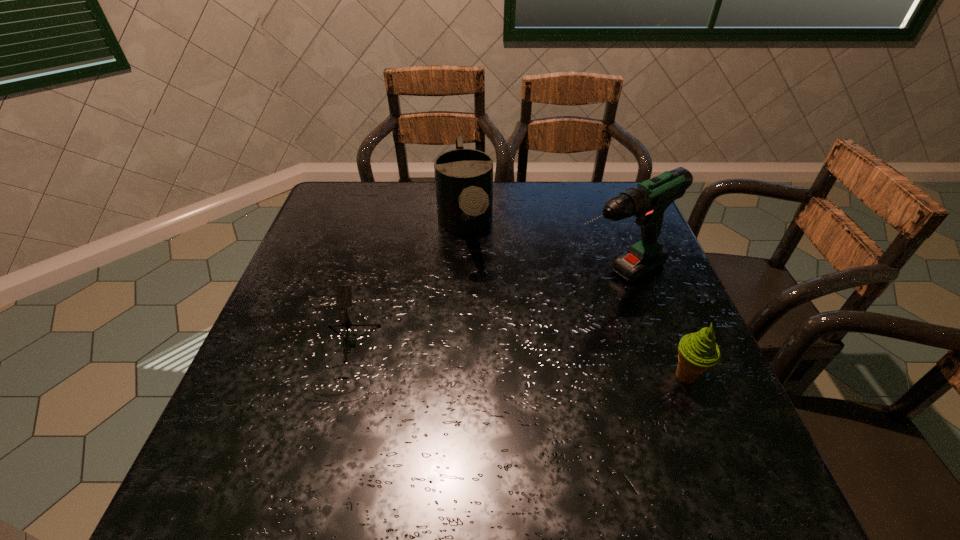
Find the location of a particular element. This screenshot has height=540, width=960. microphone is located at coordinates (344, 292).

You are a GUI agent. You are given a task and a screenshot of the screen. Output one action in this format:
    pyautogui.click(x=<x>, y=<y>)
    Task: Click on the shortest object
    
    Given the screenshot: What is the action you would take?
    pyautogui.click(x=344, y=292)

Find the location of a particular element. The image size is (960, 540). icecream is located at coordinates (697, 351).

What are the coordinates of `watering can` in the screenshot? It's located at (463, 177).

You are a GUI agent. You are given a task and a screenshot of the screen. Output one action in this format:
    pyautogui.click(x=<x>, y=<y>)
    Task: Click on the third object from right to left
    
    Given the screenshot: What is the action you would take?
    pyautogui.click(x=463, y=177)

Locate an element on the screen. The width and height of the screenshot is (960, 540). drill is located at coordinates (647, 201).

Find the location of a particular element. Image resolution: width=960 pixels, height=540 pixels. vacant area situated on the stand of the shortest object is located at coordinates tap(322, 437).

Where is `vacant space located on the left of the third tallest object`? This screenshot has height=540, width=960. vacant space located on the left of the third tallest object is located at coordinates (632, 376).

You are a GUI agent. You are given a task and a screenshot of the screen. Output one action in this format:
    pyautogui.click(x=<x>, y=<y>)
    Task: Click on the free space located with the spout on the watering can
    This screenshot has height=540, width=960.
    Given the screenshot: What is the action you would take?
    pyautogui.click(x=489, y=398)

Where is `vacant space located 0.250m with the spout on the watering can`? The width and height of the screenshot is (960, 540). vacant space located 0.250m with the spout on the watering can is located at coordinates (481, 352).